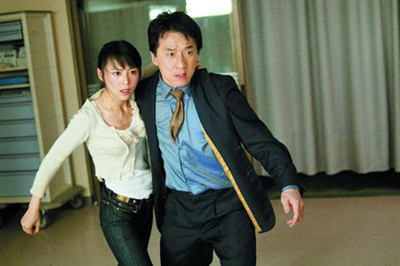
Where is `curtain`? This screenshot has width=400, height=266. curtain is located at coordinates (284, 94).